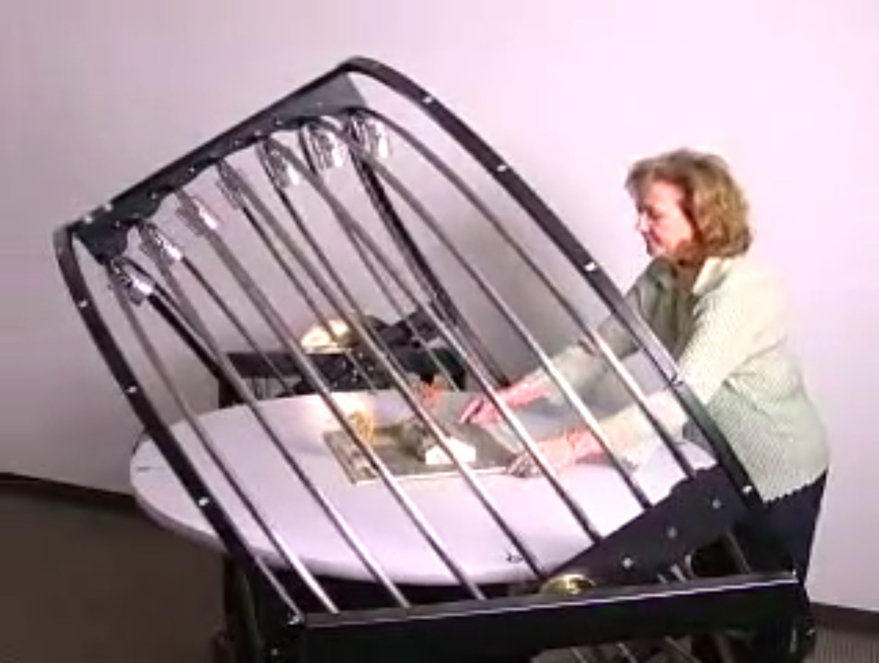
You are a GUI agent. You are given a task and a screenshot of the screen. Output one action in this format:
    pyautogui.click(x=<x>, y=<y>)
    Task: Click on the chair
    
    Given the screenshot: What is the action you would take?
    click(x=335, y=324)